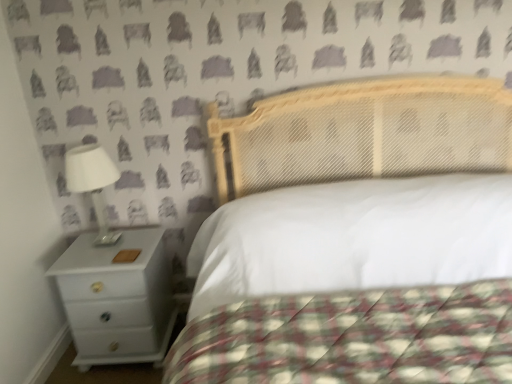
Question: Is point (476, 347) positioned closer to the camera than point (161, 231)?

Choices:
 (A) closer
 (B) farther

Answer: (A)

Question: Is white quilted fabric at center taller or shorter than white glossy nightstand at lower left?

Choices:
 (A) short
 (B) tall

Answer: (B)

Question: Estimate the real-world distances between objects in this image. Which object is farther from the white quilted fabric at center?

Choices:
 (A) white glossy nightstand at lower left
 (B) white glossy lamp at left

Answer: (B)

Question: Which of these objects is positioned closest to the white glossy nightstand at lower left?

Choices:
 (A) white quilted fabric at center
 (B) white glossy lamp at left

Answer: (B)